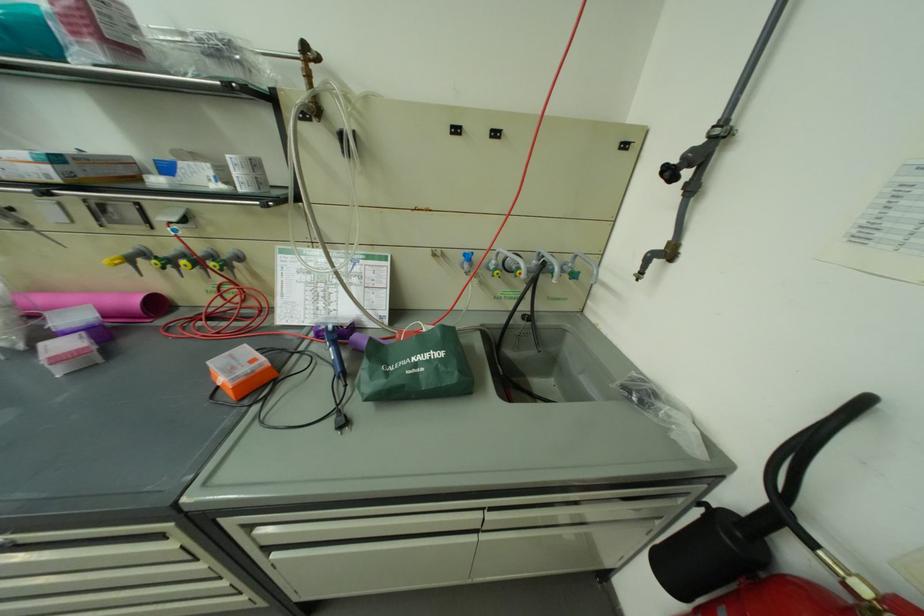
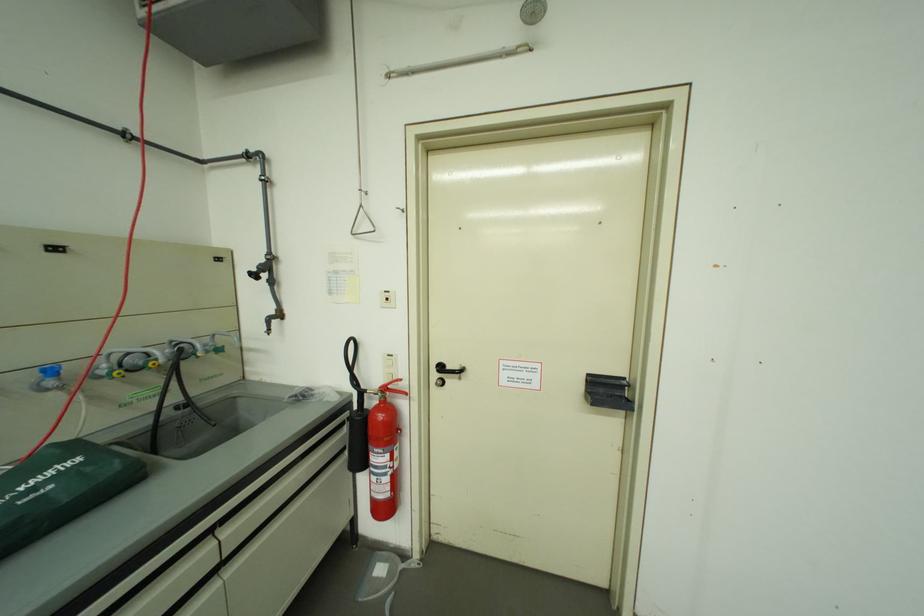
In the second image, find the point that corresponds to [524,270] in the first image.

(150, 365)